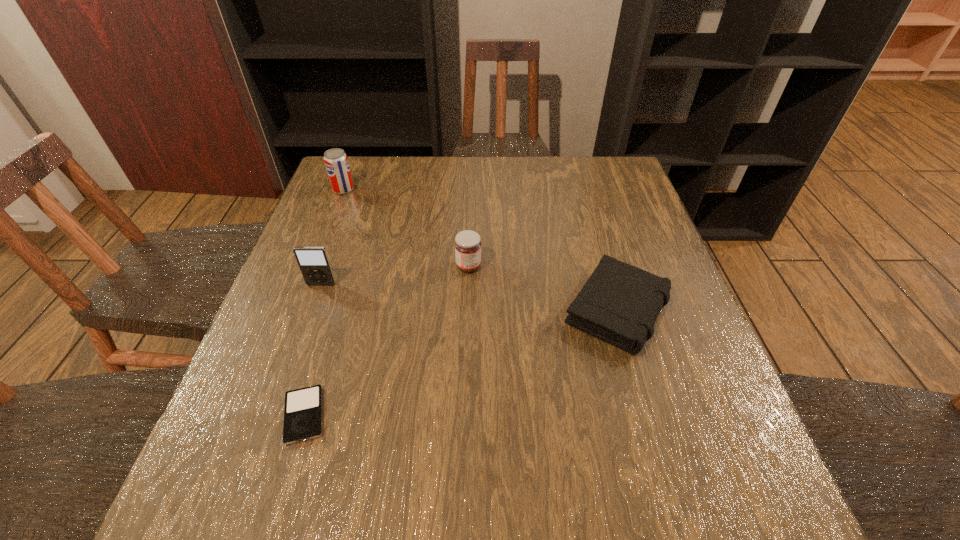
In the image, there is a desktop. At what (x,y) coordinates should I click in order to perform the action: click on blank space at the right edge. Please return your answer as a coordinate pair (x, y). Looking at the image, I should click on (637, 249).

Locate an element on the screen. The height and width of the screenshot is (540, 960). free space at the far left corner of the desktop is located at coordinates (361, 177).

The image size is (960, 540). I want to click on vacant space at the near left corner of the desktop, so click(219, 498).

The height and width of the screenshot is (540, 960). Identify the location of free spot between the third tallest object and the farthest object. (406, 228).

Find the location of a particular element. The height and width of the screenshot is (540, 960). blank region between the shortest object and the soda is located at coordinates (324, 302).

Locate an element on the screen. Image resolution: width=960 pixels, height=540 pixels. vacant space that's between the second object from right to left and the shorter iPod is located at coordinates (386, 341).

In order to click on vacant area between the shortest object and the farthest object in this screenshot , I will do `click(324, 302)`.

Locate an element on the screen. free spot between the farthest object and the fourth object from left to right is located at coordinates (406, 228).

I want to click on vacant space in between the farthest object and the shorter iPod, so click(324, 302).

This screenshot has height=540, width=960. I want to click on free area in between the taller iPod and the third tallest object, so click(x=395, y=275).